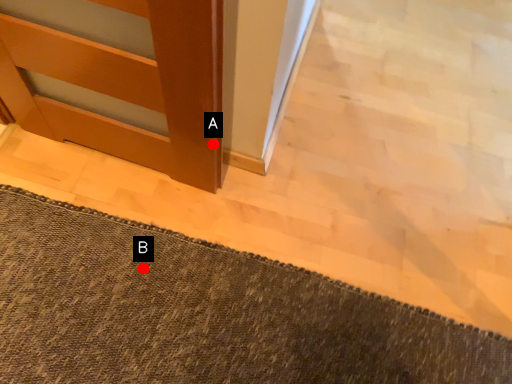
Question: Two points are circled on the image, labeled by A and B beside each circle. Which point is farther from the camera taking this photo?

Choices:
 (A) A is further
 (B) B is further

Answer: (B)